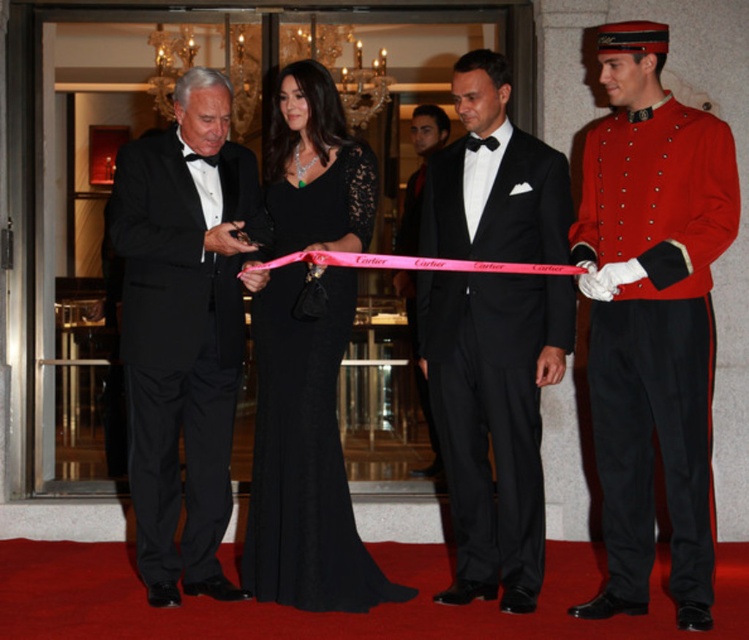
Where is the black lace dress at center located in the image?

The black lace dress at center is located at point (303, 454).

You are a photographer at the event and need to capture a photo where both the red cotton uniform at right and the black satin tuxedo at center are clearly visible. Based on their positions, which one should you focus on first to ensure both are in frame?

The red cotton uniform at right is below the black satin tuxedo at center, so you should focus on the black satin tuxedo at center first to ensure both are in frame.

You are a photographer at the event and want to capture a photo of the black satin tuxedo at center and the matte black tuxedo at left. Based on their heights, which one should you focus on first to ensure they both fit in the frame?

The black satin tuxedo at center is taller than the matte black tuxedo at left, so you should focus on the black satin tuxedo at center first to ensure both fit in the frame.